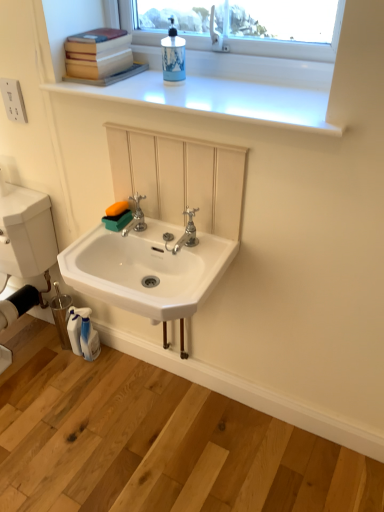
Question: Does point (173, 444) appear closer or farther from the camera than point (142, 224)?

Choices:
 (A) closer
 (B) farther

Answer: (B)

Question: Considering the positions of white glossy sink at lower center and silver metallic faucet at center, marked as the 1th tap in a left-to-right arrangement, in the image, is white glossy sink at lower center bigger or smaller than silver metallic faucet at center, marked as the 1th tap in a left-to-right arrangement,?

Choices:
 (A) big
 (B) small

Answer: (A)

Question: Which of these objects is positioned closest to the blue ceramic soap dispenser at upper center?

Choices:
 (A) white glossy sink at lower center
 (B) hardcover books at upper left
 (C) white glossy window sill at upper center
 (D) polished chrome faucet at center, positioned as the 2th tap in left-to-right order
 (E) white glossy sink at center

Answer: (C)

Question: Which object is the farthest from the hardcover books at upper left?

Choices:
 (A) white plastic electrical outlet at upper left
 (B) polished chrome faucet at center, positioned as the 1th tap in right-to-left order
 (C) white glossy sink at center
 (D) silver metallic faucet at center, the second tap from the right
 (E) blue ceramic soap dispenser at upper center

Answer: (C)